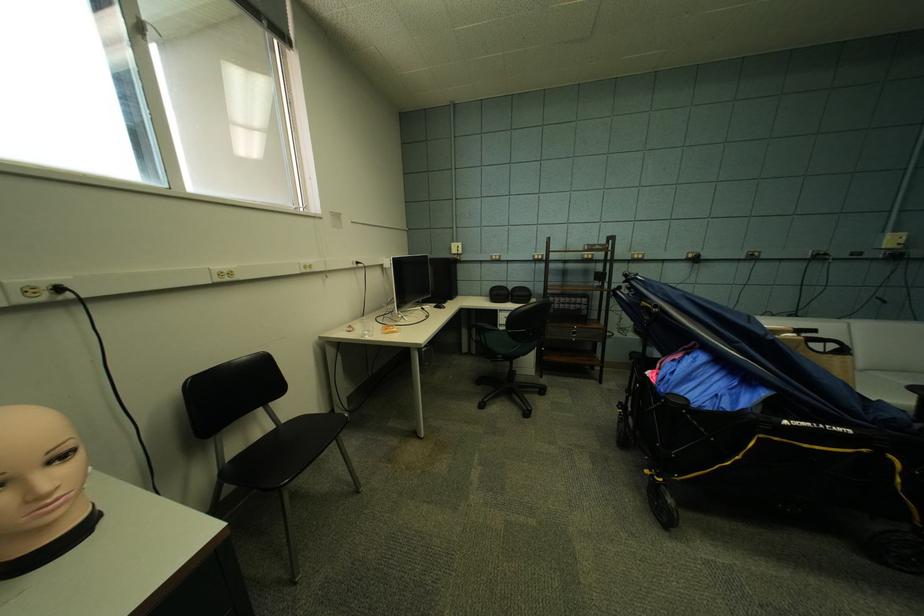
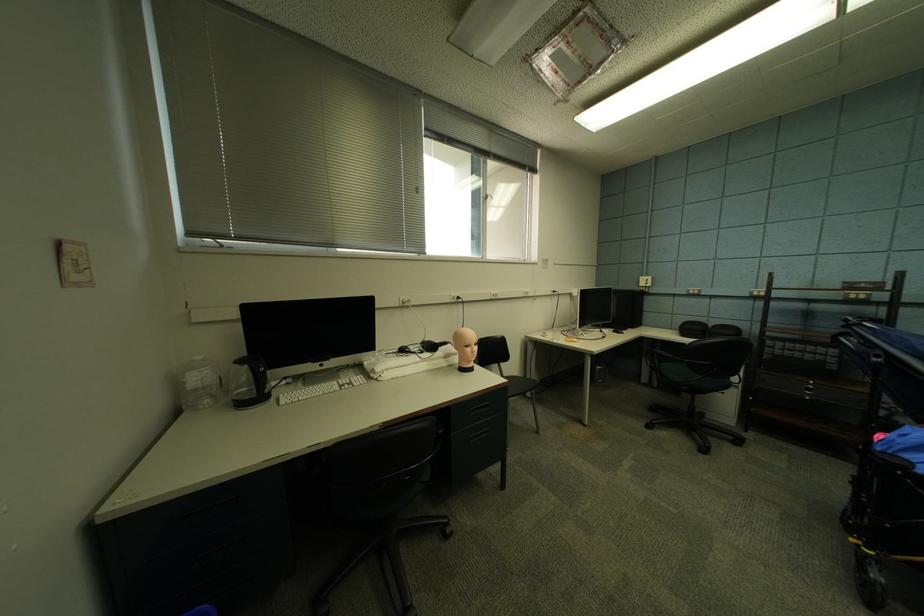
Where in the second image is the point corresponding to point 462,248 from the first image?

(650, 282)